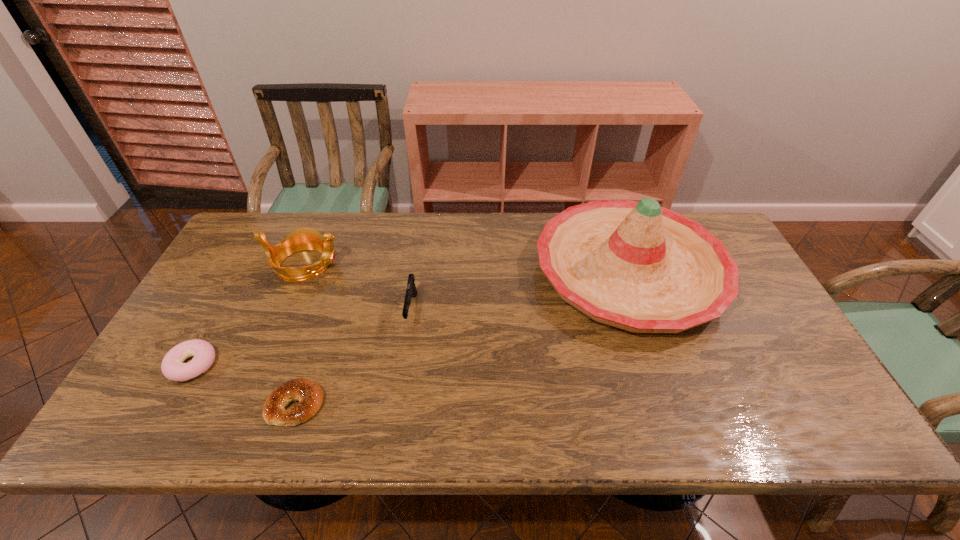
What are the coordinates of `the rightmost object` in the screenshot? It's located at (636, 266).

The image size is (960, 540). Find the location of `sombrero`. sombrero is located at coordinates click(636, 266).

The height and width of the screenshot is (540, 960). I want to click on the second tallest object, so click(x=305, y=238).

Find the location of `the third shortest object`. the third shortest object is located at coordinates (411, 292).

At what (x,y) coordinates should I click in order to perform the action: click on gun. Please return your answer as a coordinate pair (x, y). Looking at the image, I should click on (411, 292).

At what (x,y) coordinates should I click in order to perform the action: click on the leftmost object. Please return your answer as a coordinate pair (x, y). Looking at the image, I should click on (172, 366).

I want to click on bagel, so click(x=309, y=394).

You are a GUI agent. You are given a task and a screenshot of the screen. Output one action in this format:
    pyautogui.click(x=<x>, y=<y>)
    Task: Click on the free spot located on the left of the sombrero
    
    Given the screenshot: What is the action you would take?
    pyautogui.click(x=453, y=272)

You are a GUI agent. You are given a task and a screenshot of the screen. Output one action in this format:
    pyautogui.click(x=<x>, y=<y>)
    Task: Click on the free location located at the front emblem of the tiara
    The image size is (960, 540).
    Given the screenshot: What is the action you would take?
    pyautogui.click(x=414, y=265)

At what (x,y) coordinates should I click in order to perform the action: click on blank space located 0.090m at the aiming end of the second object from right to left. Please return your answer as a coordinate pair (x, y). The image size is (960, 540). Looking at the image, I should click on (404, 362).